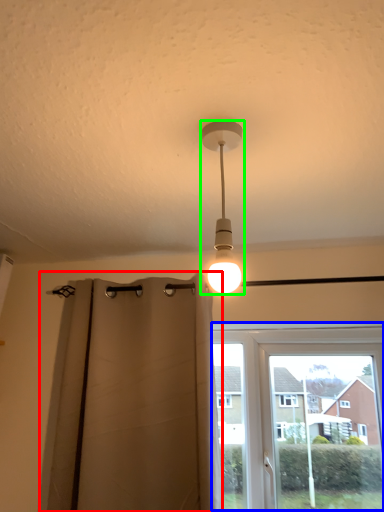
Question: Estimate the real-world distances between objects in this image. Which object is closer to curtain (highlighted by a red box), window (highlighted by a blue box) or lamp (highlighted by a green box)?

Choices:
 (A) window
 (B) lamp

Answer: (A)